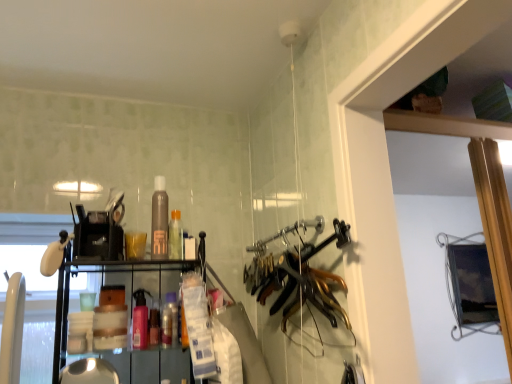
Question: Would you say gold metallic hangers at center is inside or outside brown matte bottle at center, which appears as the 1th bottle when viewed from the top?

Choices:
 (A) outside
 (B) inside

Answer: (A)

Question: In terms of width, does gold metallic hangers at center look wider or thinner when compared to brown matte bottle at center, which appears as the 1th bottle when viewed from the top?

Choices:
 (A) thin
 (B) wide

Answer: (B)

Question: Which of these objects is positioned farthest from the pink matte spray bottle at center, which ranks as the 2th bottle in bottom-to-top order?

Choices:
 (A) gold metallic hangers at center
 (B) brown matte bottle at center, which appears as the 1th bottle when viewed from the top
 (C) translucent plastic bottle at center, the second bottle when ordered from top to bottom
 (D) translucent plastic bottle at center, positioned as the 4th bottle in top-to-bottom order

Answer: (A)

Question: Which object is positioned closest to the translucent plastic bottle at center, positioned as the 4th bottle in top-to-bottom order?

Choices:
 (A) brown matte bottle at center, which appears as the 1th bottle when viewed from the top
 (B) translucent plastic bottle at center, the second bottle when ordered from top to bottom
 (C) pink matte spray bottle at center, arranged as the third bottle when viewed from the top
 (D) gold metallic hangers at center

Answer: (C)